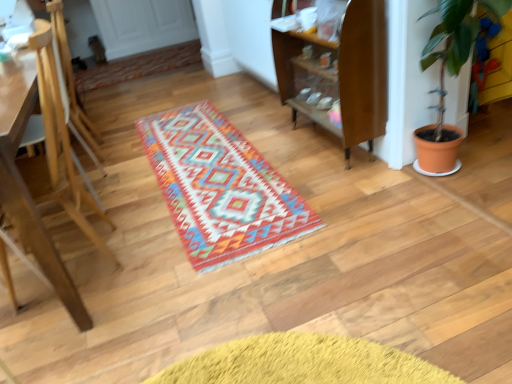
Measure the distance between multicolored woven rug at upper center and camera.

multicolored woven rug at upper center is 3.94 meters from camera.

What do you see at coordinates (138, 66) in the screenshot? I see `multicolored woven rug at upper center` at bounding box center [138, 66].

Describe the element at coordinates (47, 176) in the screenshot. The image size is (512, 384). I see `light brown wooden easel at left` at that location.

The width and height of the screenshot is (512, 384). What do you see at coordinates (220, 187) in the screenshot?
I see `multicolored woven rug at center` at bounding box center [220, 187].

Where is `terracotta pot at right`? This screenshot has height=384, width=512. terracotta pot at right is located at coordinates (451, 75).

In terms of size, does terracotta pot at right appear bigger or smaller than light brown wooden easel at left?

Considering their sizes, terracotta pot at right takes up less space than light brown wooden easel at left.

Does terracotta pot at right have a greater width compared to light brown wooden easel at left?

No, terracotta pot at right is not wider than light brown wooden easel at left.

Does terracotta pot at right appear on the right side of light brown wooden easel at left?

Yes.

Is wooden armchair at left inside the boundaries of multicolored woven rug at center, or outside?

wooden armchair at left is not enclosed by multicolored woven rug at center.

Which is more to the left, wooden armchair at left or multicolored woven rug at center?

Positioned to the left is wooden armchair at left.

How different are the orientations of wooden armchair at left and multicolored woven rug at center in degrees?

179 degrees separate the facing orientations of wooden armchair at left and multicolored woven rug at center.

Relative to multicolored woven rug at center, is wooden armchair at left in front or behind?

Clearly, wooden armchair at left is behind multicolored woven rug at center.

Is wooden armchair at left positioned with its back to multicolored woven rug at upper center?

wooden armchair at left does not have its back to multicolored woven rug at upper center.

Can you confirm if wooden armchair at left is bigger than multicolored woven rug at upper center?

Yes.

Is wooden armchair at left in contact with multicolored woven rug at upper center?

No, wooden armchair at left is not next to multicolored woven rug at upper center.

Based on the photo, can you confirm if wooden armchair at left is positioned to the right of multicolored woven rug at upper center?

Indeed, wooden armchair at left is positioned on the right side of multicolored woven rug at upper center.

Is multicolored woven rug at upper center with wooden shelf at center?

multicolored woven rug at upper center and wooden shelf at center are not in contact.

Based on the photo, from the image's perspective, is multicolored woven rug at upper center under wooden shelf at center?

Incorrect, from the image's perspective, multicolored woven rug at upper center is higher than wooden shelf at center.

In the image, is multicolored woven rug at upper center on the left side or the right side of wooden shelf at center?

Clearly, multicolored woven rug at upper center is on the left of wooden shelf at center in the image.

Considering the sizes of light brown wooden easel at left and terracotta pot at right in the image, is light brown wooden easel at left taller or shorter than terracotta pot at right?

light brown wooden easel at left is shorter than terracotta pot at right.

Looking at this image, which is more to the right, light brown wooden easel at left or terracotta pot at right?

Positioned to the right is terracotta pot at right.

Is light brown wooden easel at left located outside terracotta pot at right?

Indeed, light brown wooden easel at left is completely outside terracotta pot at right.

Is point (30, 195) behind point (448, 25)?

No, (30, 195) is closer to viewer.

The height and width of the screenshot is (384, 512). What are the coordinates of `doormat behind the multicolored woven rug at center` in the screenshot? It's located at (138, 66).

Who is more distant, multicolored woven rug at center or multicolored woven rug at upper center?

multicolored woven rug at upper center is further away from the camera.

Is multicolored woven rug at center placed right next to multicolored woven rug at upper center?

No, multicolored woven rug at center is not touching multicolored woven rug at upper center.

Between multicolored woven rug at center and multicolored woven rug at upper center, which one has more height?

multicolored woven rug at center.

Based on their positions, is terracotta pot at right located to the left or right of multicolored woven rug at center?

Clearly, terracotta pot at right is on the right of multicolored woven rug at center in the image.

Is terracotta pot at right taller or shorter than multicolored woven rug at center?

Considering their sizes, terracotta pot at right has more height than multicolored woven rug at center.

Find the location of a particular element. houseplant that is above the multicolored woven rug at center (from the image's perspective) is located at coordinates (451, 75).

How different are the orientations of terracotta pot at right and multicolored woven rug at center in degrees?

There is a 87.2-degree angle between the facing directions of terracotta pot at right and multicolored woven rug at center.

You are a GUI agent. You are given a task and a screenshot of the screen. Output one action in this format:
    pyautogui.click(x=<x>, y=<y>)
    Task: Click on the houseplant on the right of light brown wooden easel at left
    The height and width of the screenshot is (384, 512).
    Given the screenshot: What is the action you would take?
    pyautogui.click(x=451, y=75)

I want to click on mat in front of the wooden armchair at left, so click(x=220, y=187).

Which object lies further to the anchor point wooden shelf at center, terracotta pot at right or multicolored woven rug at upper center?

multicolored woven rug at upper center.

Which object lies nearer to the anchor point multicolored woven rug at upper center, wooden armchair at left or terracotta pot at right?

wooden armchair at left.

From the image, which object appears to be farther from multicolored woven rug at upper center, terracotta pot at right or light brown wooden easel at left?

terracotta pot at right lies further to multicolored woven rug at upper center than the other object.

Looking at the image, which one is located further to light brown wooden easel at left, wooden shelf at center or multicolored woven rug at center?

The object further to light brown wooden easel at left is wooden shelf at center.

From the image, which object appears to be nearer to multicolored woven rug at center, light brown wooden easel at left or terracotta pot at right?

Among the two, light brown wooden easel at left is located nearer to multicolored woven rug at center.

Looking at the image, which one is located closer to wooden armchair at left, wooden shelf at center or light brown wooden easel at left?

Based on the image, light brown wooden easel at left appears to be nearer to wooden armchair at left.

From the image, which object appears to be farther from light brown wooden easel at left, wooden armchair at left or wooden shelf at center?

wooden shelf at center.

From the picture: Based on their spatial positions, is terracotta pot at right or light brown wooden easel at left closer to wooden armchair at left?

light brown wooden easel at left is positioned closer to the anchor wooden armchair at left.

The image size is (512, 384). What are the coordinates of `armchair situated between light brown wooden easel at left and terracotta pot at right from left to right` in the screenshot? It's located at (73, 87).

Identify the location of shelf between light brown wooden easel at left and terracotta pot at right in the horizontal direction. The height and width of the screenshot is (384, 512). (343, 74).

You are a GUI agent. You are given a task and a screenshot of the screen. Output one action in this format:
    pyautogui.click(x=<x>, y=<y>)
    Task: Click on the mat located between light brown wooden easel at left and terracotta pot at right in the left-right direction
    
    Given the screenshot: What is the action you would take?
    pyautogui.click(x=220, y=187)

Image resolution: width=512 pixels, height=384 pixels. Find the location of `shelf between multicolored woven rug at center and multicolored woven rug at upper center from front to back`. shelf between multicolored woven rug at center and multicolored woven rug at upper center from front to back is located at coordinates (343, 74).